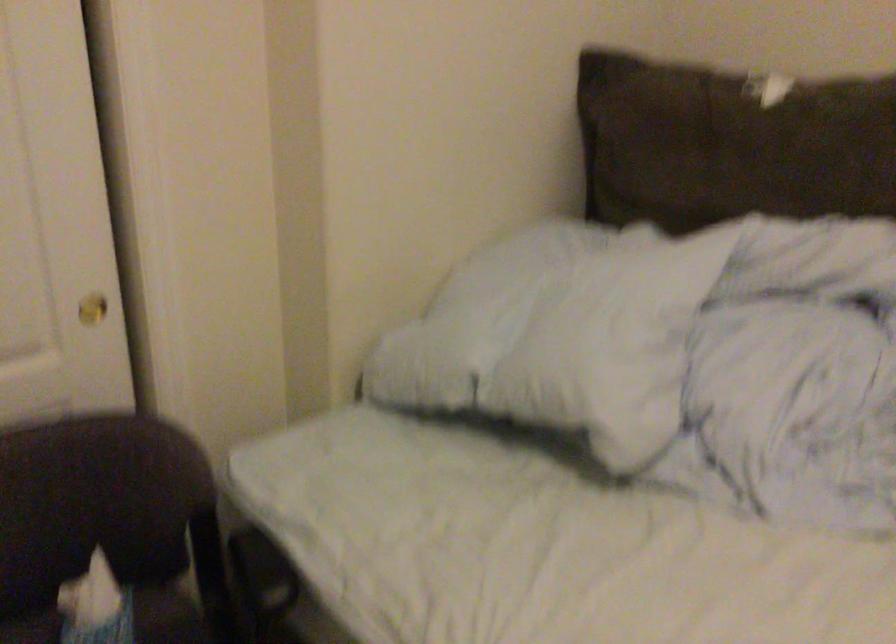
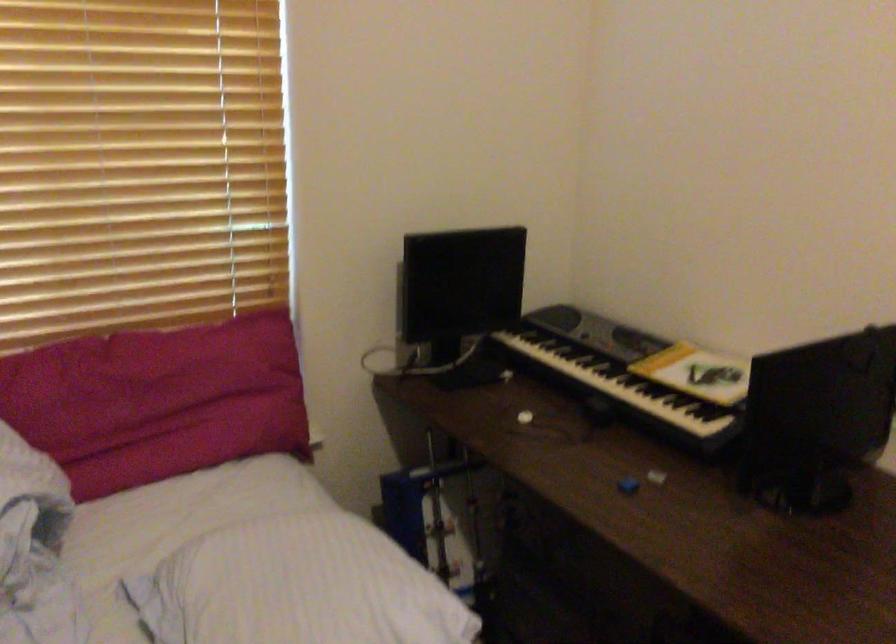
Question: The first image is from the beginning of the video and the second image is from the end. How did the camera likely rotate when shooting the video?

Choices:
 (A) Left
 (B) Right
 (C) Up
 (D) Down

Answer: (B)